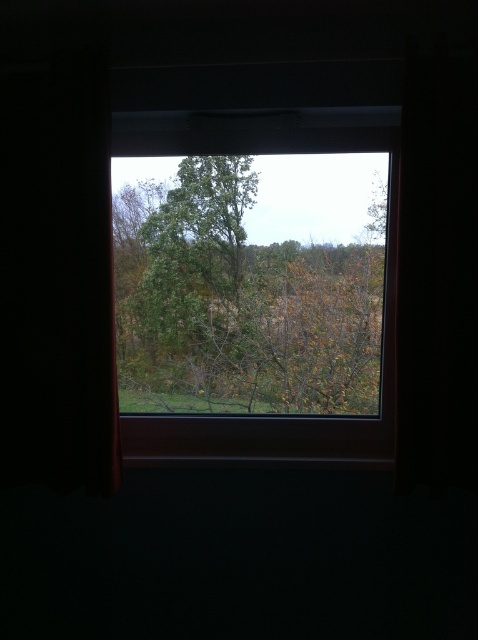
Question: Which point is farther to the camera?

Choices:
 (A) black fabric curtain at left
 (B) transparent glass window at center

Answer: (B)

Question: Does transparent glass window at center come behind green leafy tree at center?

Choices:
 (A) yes
 (B) no

Answer: (B)

Question: Which point is farther to the camera?

Choices:
 (A) click(52, 88)
 (B) click(339, 240)
 (C) click(237, 241)

Answer: (C)

Question: Does transparent glass window at center have a larger size compared to green leafy tree at center?

Choices:
 (A) no
 (B) yes

Answer: (B)

Question: Which of these objects is positioned closest to the transparent glass window at center?

Choices:
 (A) black fabric curtain at left
 (B) green leafy tree at center

Answer: (B)

Question: Observing the image, what is the correct spatial positioning of transparent glass window at center in reference to green leafy tree at center?

Choices:
 (A) right
 (B) left

Answer: (A)